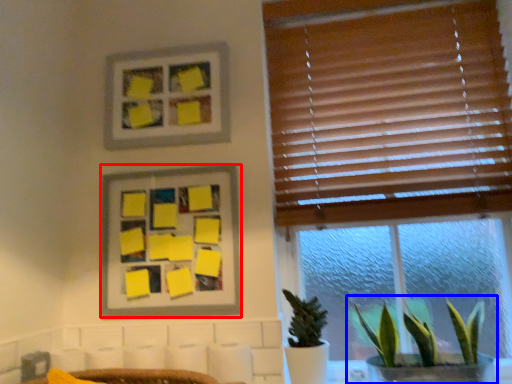
Question: Among these objects, which one is nearest to the camera, picture frame (highlighted by a red box) or houseplant (highlighted by a blue box)?

Choices:
 (A) picture frame
 (B) houseplant

Answer: (B)